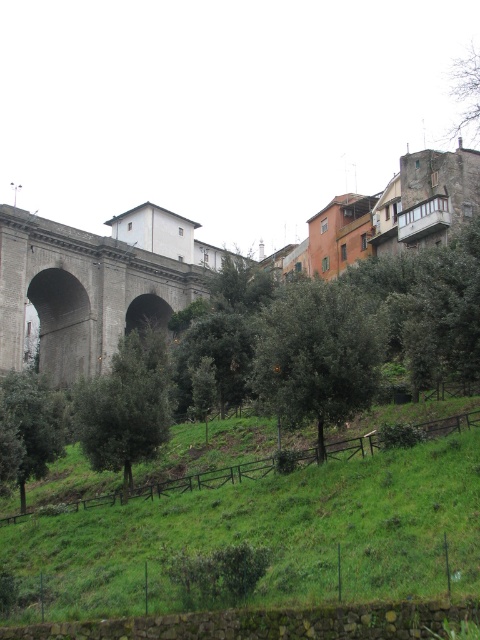
You are standing at the base of the green matte tree at center. Looking towards the large stone bridge on the left, which direction should you walk to reach the bridge?

Since the large stone bridge is on the left side of the image and the green matte tree at center is positioned at coordinates closer to the right side, you should walk towards the left to reach the bridge.

Consider the image. You are a city planner assessing the urban landscape. You need to determine if a new 10m tall statue can be placed between the gray stone bridge at upper left and the green matte tree at center without blocking the view of either. Considering their heights, is this feasible?

The gray stone bridge at upper left is taller than the green matte tree at center. Since the new statue is 10m tall, it could potentially block the view of both if placed between them, especially since the bridge is already taller. To avoid obstruction, the statue should be positioned elsewhere where its height won